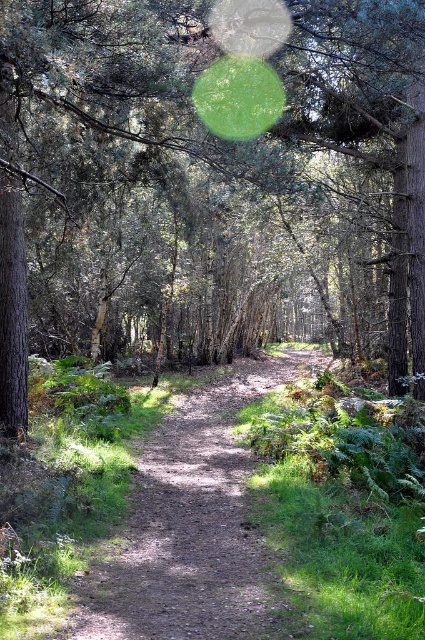
Question: Which point is closer to the camera taking this photo?

Choices:
 (A) (65, 200)
 (B) (125, 596)

Answer: (B)

Question: Can you confirm if green leafy tree at center is smaller than dirt path at center?

Choices:
 (A) yes
 (B) no

Answer: (B)

Question: Does green leafy tree at center have a lesser width compared to dirt path at center?

Choices:
 (A) yes
 (B) no

Answer: (B)

Question: Which point appears closest to the camera in this image?

Choices:
 (A) (125, 602)
 (B) (175, 356)

Answer: (A)

Question: Is green leafy tree at center positioned at the back of dirt path at center?

Choices:
 (A) yes
 (B) no

Answer: (A)